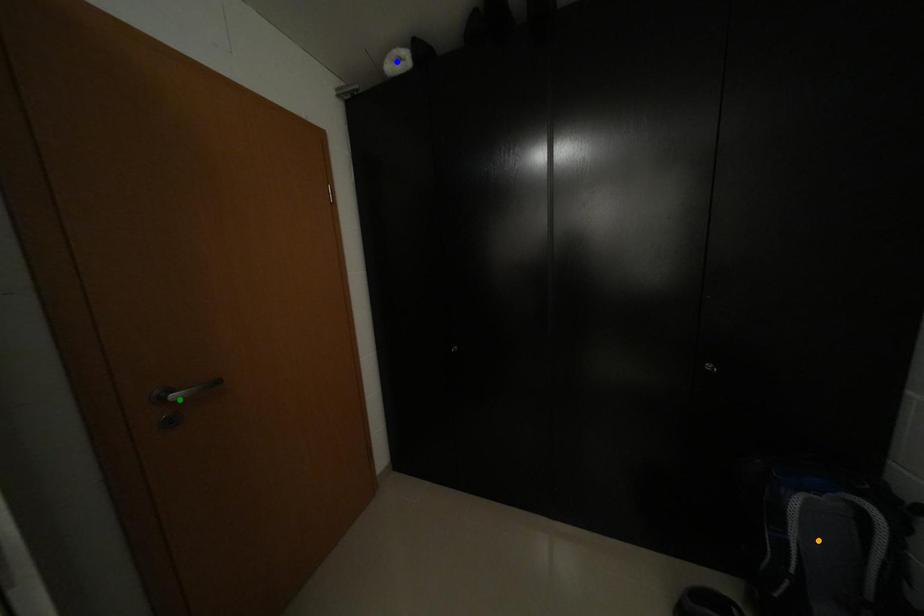
Order these from nearest to farthest:
blue point
orange point
green point

orange point → green point → blue point